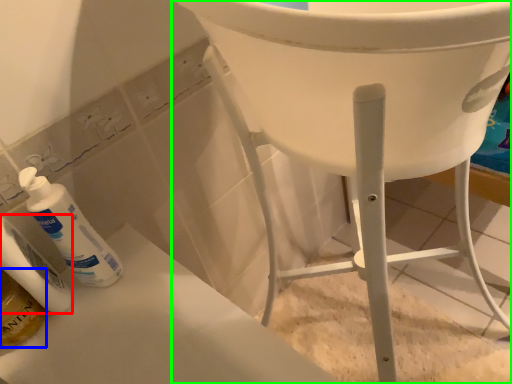
Question: Which is nearer to the toiletry (highlighted by a red box)? mouthwash (highlighted by a blue box) or furniture (highlighted by a green box).

Choices:
 (A) mouthwash
 (B) furniture

Answer: (A)